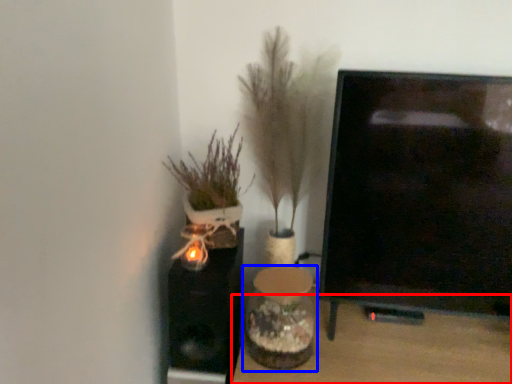
Question: Among these objects, which one is nearest to the camera, furniture (highlighted by a red box) or vase (highlighted by a blue box)?

Choices:
 (A) furniture
 (B) vase

Answer: (A)